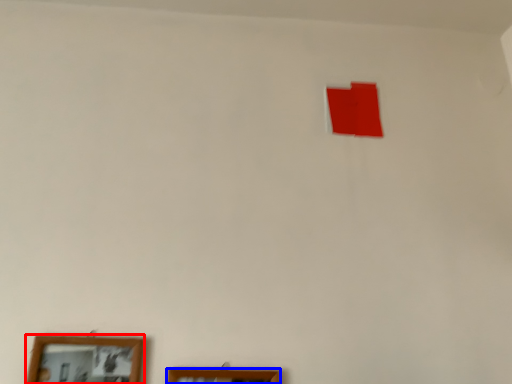
Question: Among these objects, which one is nearest to the camera, picture frame (highlighted by a red box) or picture frame (highlighted by a blue box)?

Choices:
 (A) picture frame
 (B) picture frame

Answer: (A)